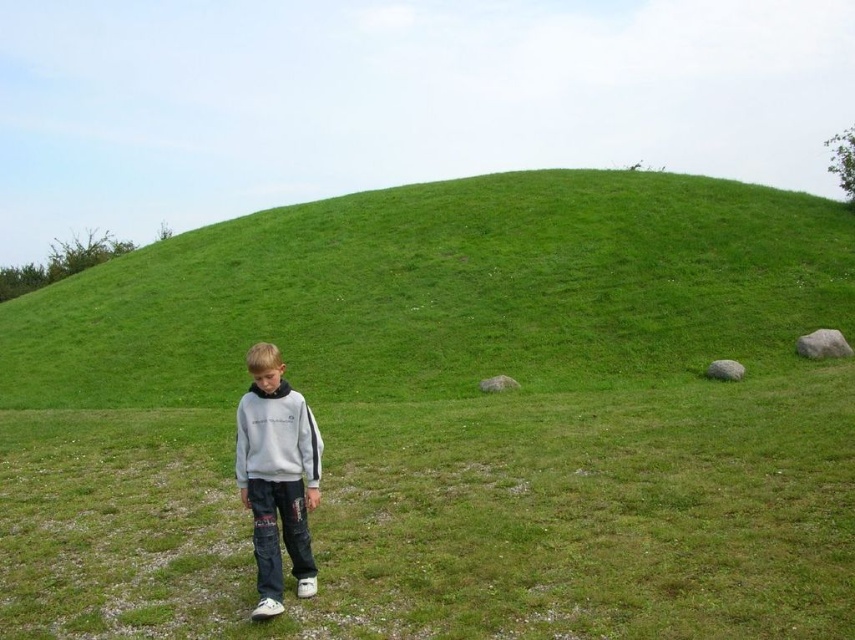
Does gray cotton sweatshirt at center appear on the right side of gray fleece sweatshirt at center?

Incorrect, gray cotton sweatshirt at center is not on the right side of gray fleece sweatshirt at center.

In the scene shown: Who is more distant from viewer, [270,557] or [321,444]?

Point [321,444]

Who is more distant from viewer, (x=275, y=548) or (x=242, y=468)?

Point (x=242, y=468)

At what (x,y) coordinates should I click in order to perform the action: click on gray cotton sweatshirt at center. Please return your answer as a coordinate pair (x, y). Image resolution: width=855 pixels, height=640 pixels. Looking at the image, I should click on (276, 476).

Does point (440, 312) come farther from viewer compared to point (282, 448)?

Yes, it is behind point (282, 448).

Locate an element on the screen. This screenshot has height=640, width=855. green grassy hillside at center is located at coordinates (445, 292).

Who is more distant from viewer, (x=326, y=282) or (x=292, y=483)?

The point (x=326, y=282) is more distant.

Between green grassy hillside at center and gray cotton sweatshirt at center, which one has more height?

green grassy hillside at center is taller.

The image size is (855, 640). What do you see at coordinates (445, 292) in the screenshot?
I see `green grassy hillside at center` at bounding box center [445, 292].

Locate an element on the screen. Image resolution: width=855 pixels, height=640 pixels. green grassy hillside at center is located at coordinates (445, 292).